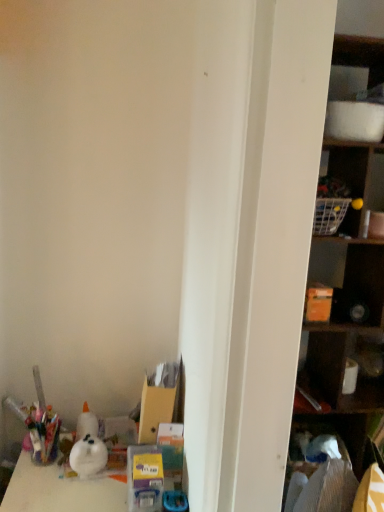
Question: Can you confirm if matte black cabinet at right is shorter than wooden shelf at right?

Choices:
 (A) yes
 (B) no

Answer: (A)

Question: Are matte black cabinet at right and wooden shelf at right far apart?

Choices:
 (A) no
 (B) yes

Answer: (A)

Question: Is matte black cabinet at right looking in the opposite direction of wooden shelf at right?

Choices:
 (A) no
 (B) yes

Answer: (B)

Question: Is matte black cabinet at right outside of wooden shelf at right?

Choices:
 (A) no
 (B) yes

Answer: (A)

Question: Is matte black cabinet at right behind wooden shelf at right?

Choices:
 (A) no
 (B) yes

Answer: (B)

Question: Considering the relative positions of matte black cabinet at right and wooden shelf at right in the image provided, is matte black cabinet at right to the right of wooden shelf at right from the viewer's perspective?

Choices:
 (A) no
 (B) yes

Answer: (A)

Question: Is wooden shelf at right at the right side of matte black cabinet at right?

Choices:
 (A) no
 (B) yes

Answer: (B)

Question: From a real-world perspective, is wooden shelf at right located higher than matte black cabinet at right?

Choices:
 (A) no
 (B) yes

Answer: (B)

Question: Is wooden shelf at right wider than matte black cabinet at right?

Choices:
 (A) no
 (B) yes

Answer: (B)

Question: Considering the relative sizes of wooden shelf at right and matte black cabinet at right in the image provided, is wooden shelf at right taller than matte black cabinet at right?

Choices:
 (A) no
 (B) yes

Answer: (B)

Question: Could you tell me if wooden shelf at right is turned towards matte black cabinet at right?

Choices:
 (A) yes
 (B) no

Answer: (A)

Question: From the image's perspective, is wooden shelf at right beneath matte black cabinet at right?

Choices:
 (A) yes
 (B) no

Answer: (B)

Question: From the image's perspective, relative to wooden shelf at right, is matte black cabinet at right above or below?

Choices:
 (A) below
 (B) above

Answer: (A)